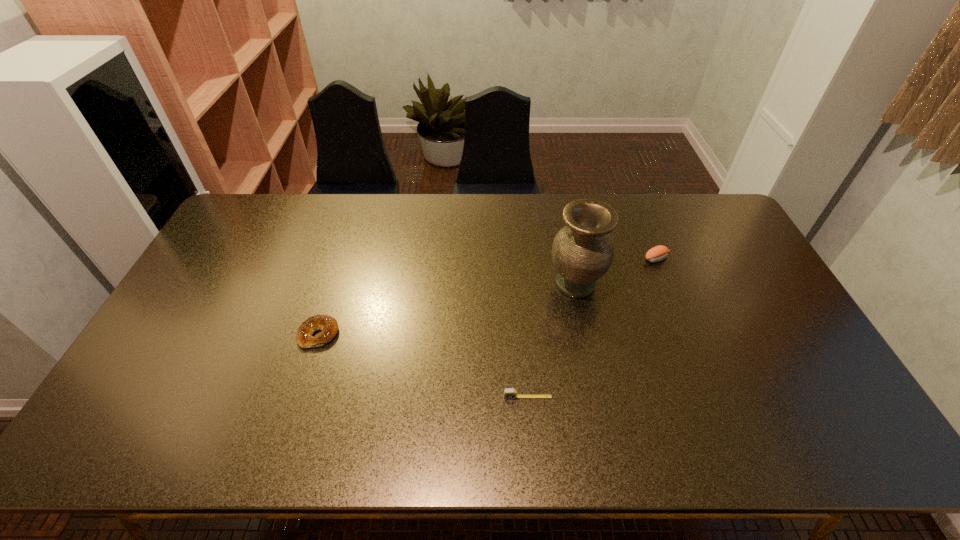
The height and width of the screenshot is (540, 960). What are the coordinates of `vase` in the screenshot? It's located at (582, 252).

Find the location of a particular element. This screenshot has height=540, width=960. the third object from left to right is located at coordinates (582, 252).

Locate an element on the screen. The height and width of the screenshot is (540, 960). the second tallest object is located at coordinates (657, 253).

Image resolution: width=960 pixels, height=540 pixels. Identify the location of sushi. (657, 253).

Where is `the leftmost object`? the leftmost object is located at coordinates (328, 325).

Locate an element on the screen. The height and width of the screenshot is (540, 960). the second nearest object is located at coordinates (328, 325).

Image resolution: width=960 pixels, height=540 pixels. In order to click on the second object from left to right in this screenshot , I will do `click(509, 393)`.

Where is `tape measure`? The image size is (960, 540). tape measure is located at coordinates (509, 393).

Where is `vacant space located on the front of the tallest object`? vacant space located on the front of the tallest object is located at coordinates tap(583, 318).

Image resolution: width=960 pixels, height=540 pixels. Identify the location of free space located on the right of the sushi. (725, 259).